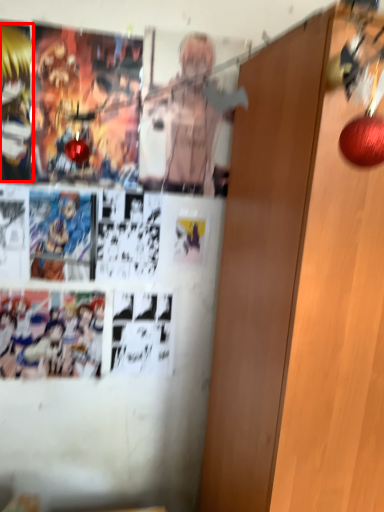
Question: From the image's perspective, considering the relative positions of person (annotated by the red box) and door in the image provided, where is person (annotated by the red box) located with respect to the staircase?

Choices:
 (A) above
 (B) below

Answer: (A)